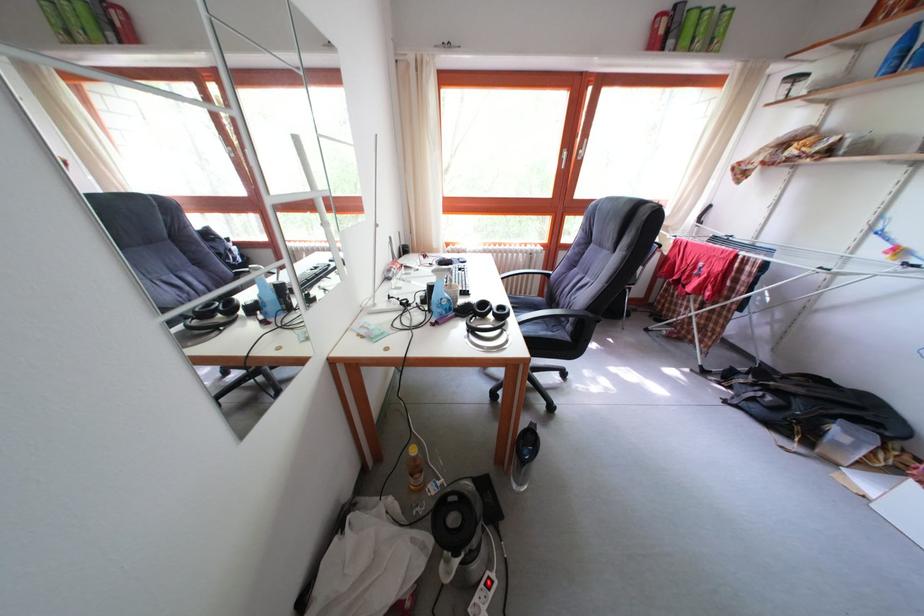
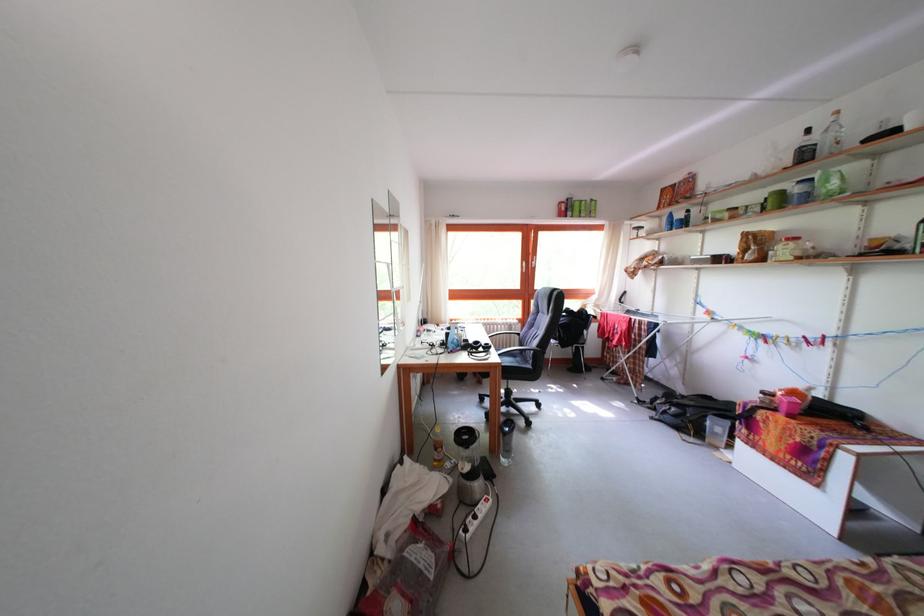
Find the pixel in the second image that matches pixel 517 321 in the first image.

(499, 354)